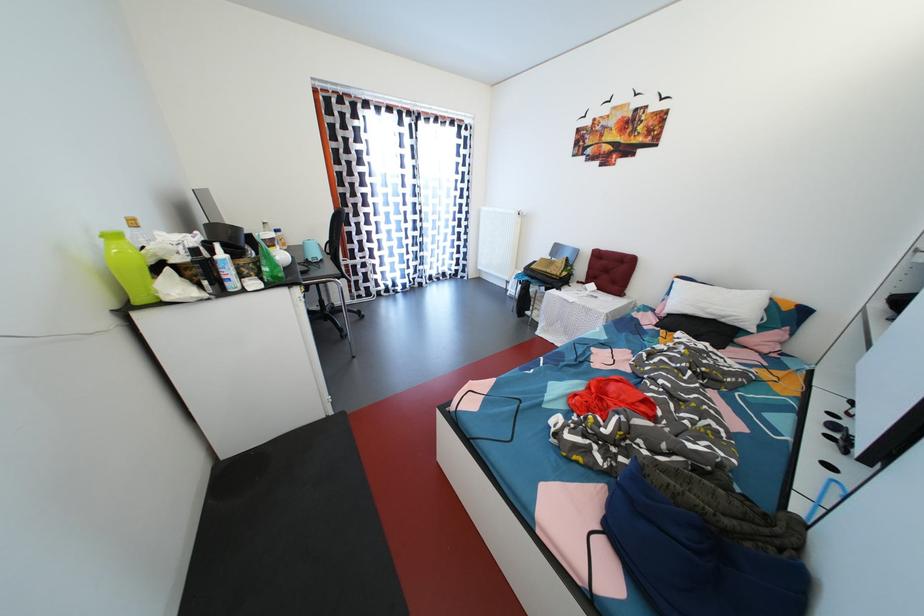
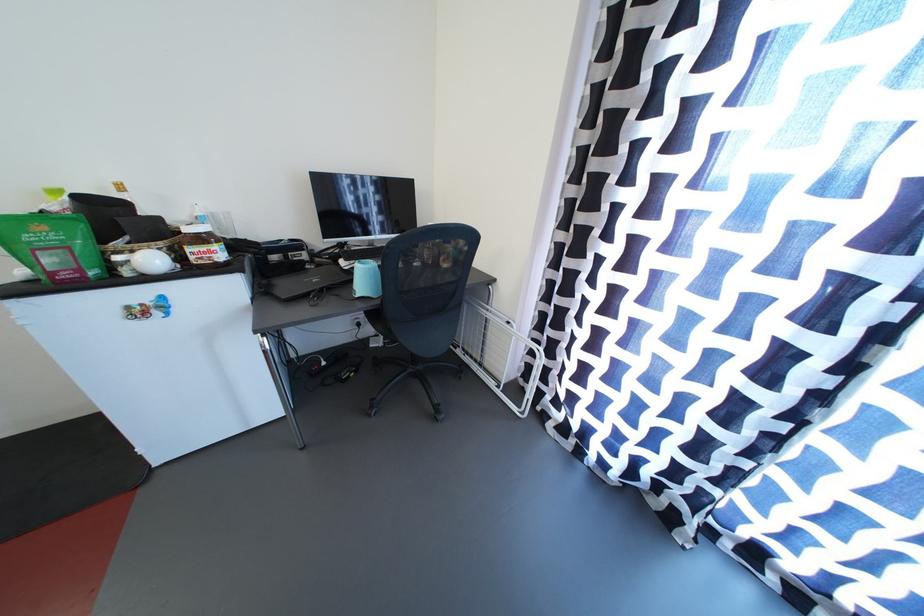
The point at (362,306) is marked in the first image. Where is the corresponding point in the second image?

(505, 397)